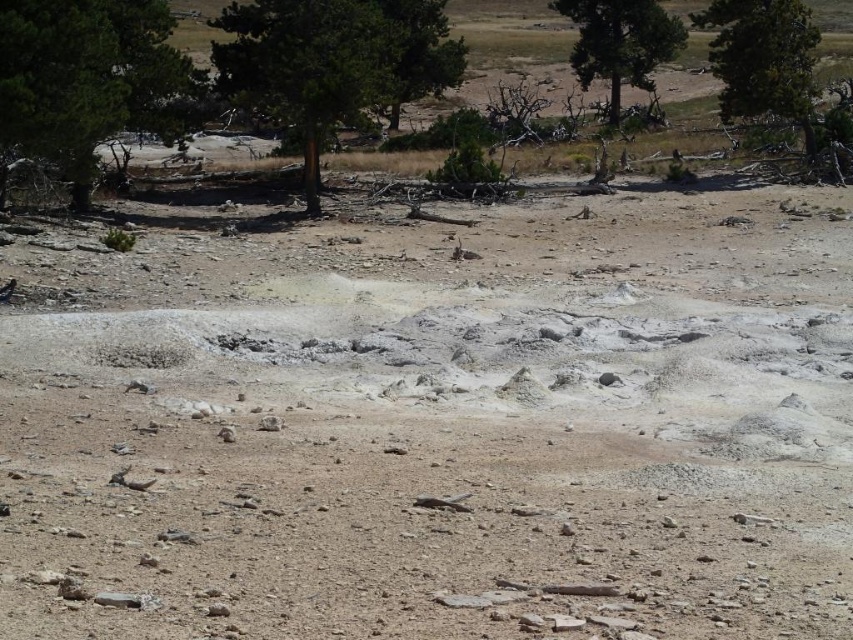
Which is below, green rough bark tree at upper left or green textured tree at upper right?

green rough bark tree at upper left

Is green rough bark tree at upper left below green textured tree at upper right?

Correct, green rough bark tree at upper left is located below green textured tree at upper right.

What do you see at coordinates (86, 77) in the screenshot? The image size is (853, 640). I see `green rough bark tree at upper left` at bounding box center [86, 77].

Locate an element on the screen. This screenshot has width=853, height=640. green rough bark tree at upper left is located at coordinates (86, 77).

Is green rough bark tree at upper center shorter than green textured tree at upper right?

Yes.

Is green rough bark tree at upper center closer to the viewer compared to green textured tree at upper right?

That is True.

You are a GUI agent. You are given a task and a screenshot of the screen. Output one action in this format:
    pyautogui.click(x=<x>, y=<y>)
    Task: Click on the green rough bark tree at upper center
    
    Given the screenshot: What is the action you would take?
    pyautogui.click(x=334, y=61)

Does dull brown dirt at center appear on the left side of green rough bark tree at upper left?

In fact, dull brown dirt at center is to the right of green rough bark tree at upper left.

Can you confirm if dull brown dirt at center is bigger than green rough bark tree at upper left?

Yes.

Who is more distant from viewer, (749, 273) or (119, 54)?

Positioned behind is point (119, 54).

The width and height of the screenshot is (853, 640). In order to click on dull brown dirt at center in this screenshot , I will do `click(437, 426)`.